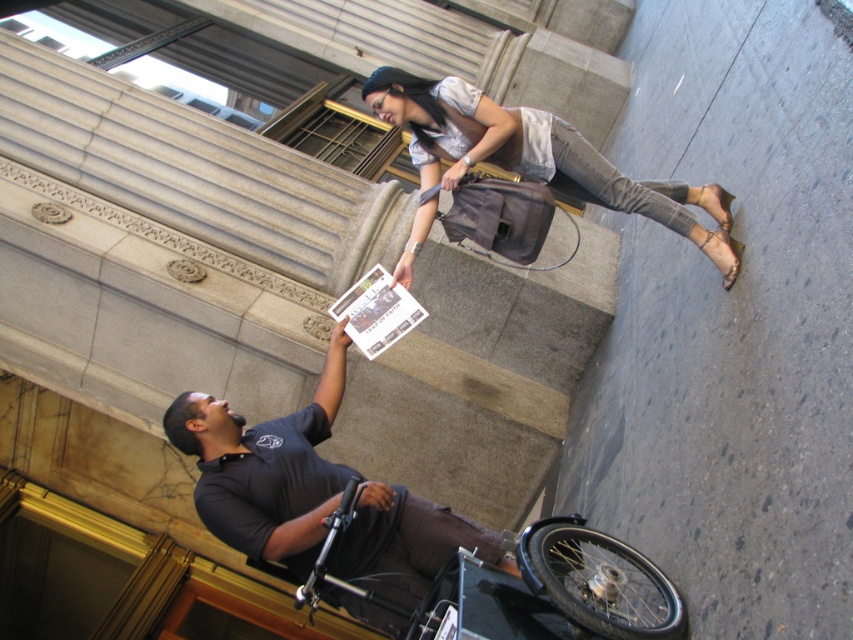
Between matte gray bag at upper center and black plastic wheelchair at lower center, which one has more height?

Standing taller between the two is matte gray bag at upper center.

Does matte gray bag at upper center have a lesser height compared to black plastic wheelchair at lower center?

Incorrect, matte gray bag at upper center's height does not fall short of black plastic wheelchair at lower center's.

Identify the location of matte gray bag at upper center. The height and width of the screenshot is (640, 853). (537, 156).

Measure the distance from dark gray shirt at center to matte gray bag at upper center.

dark gray shirt at center is 4.12 feet from matte gray bag at upper center.

Can you confirm if dark gray shirt at center is shorter than matte gray bag at upper center?

Incorrect, dark gray shirt at center's height does not fall short of matte gray bag at upper center's.

Locate an element on the screen. The width and height of the screenshot is (853, 640). dark gray shirt at center is located at coordinates (265, 468).

Where is `dark gray shirt at center`? The width and height of the screenshot is (853, 640). dark gray shirt at center is located at coordinates (265, 468).

Can you confirm if dark gray shirt at center is positioned to the left of black plastic wheelchair at lower center?

Indeed, dark gray shirt at center is positioned on the left side of black plastic wheelchair at lower center.

Is point (370, 561) in front of point (566, 540)?

No, (370, 561) is behind (566, 540).

The height and width of the screenshot is (640, 853). What do you see at coordinates (265, 468) in the screenshot?
I see `dark gray shirt at center` at bounding box center [265, 468].

Identify the location of dark gray shirt at center. (265, 468).